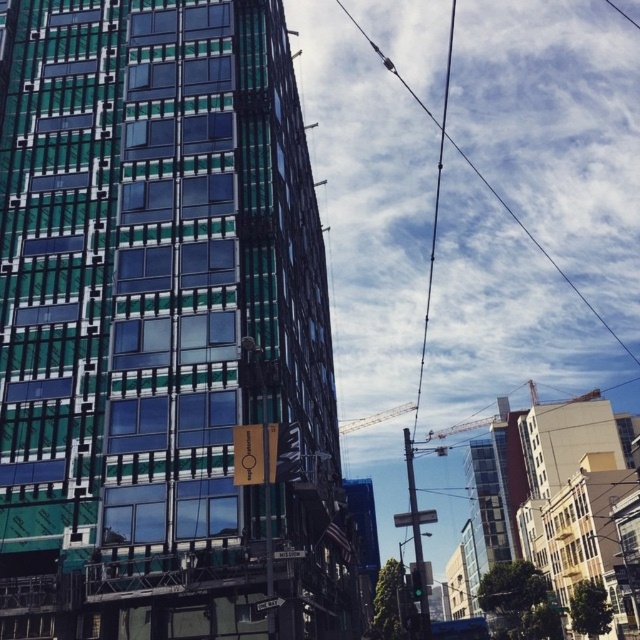
Question: Does green glass building at center appear on the left side of clear wire at upper right?

Choices:
 (A) no
 (B) yes

Answer: (B)

Question: Does metallic rectangular at center have a larger size compared to metallic one way sign at lower center?

Choices:
 (A) yes
 (B) no

Answer: (A)

Question: Is green glass building at center positioned in front of clear wire at upper right?

Choices:
 (A) yes
 (B) no

Answer: (A)

Question: Which object appears closest to the camera in this image?

Choices:
 (A) clear wire at upper right
 (B) green glass building at center

Answer: (B)

Question: Considering the real-world distances, which object is farthest from the green glass building at center?

Choices:
 (A) clear wire at upper right
 (B) metallic rectangular at center
 (C) metallic gray crane at upper center
 (D) metallic one way sign at lower center

Answer: (A)

Question: Which object is the closest to the metallic one way sign at lower center?

Choices:
 (A) metallic gray crane at upper center
 (B) clear wire at upper right

Answer: (A)